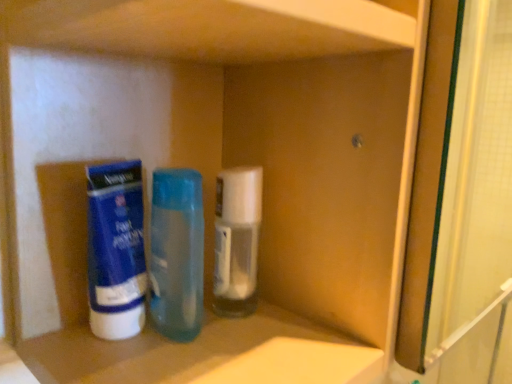
Question: Is point (169, 289) positioned closer to the camera than point (142, 246)?

Choices:
 (A) closer
 (B) farther

Answer: (B)

Question: Is translucent plastic bottle at center, the 2th bottle viewed from the right, in front of or behind blue matte tube at left in the image?

Choices:
 (A) front
 (B) behind

Answer: (B)

Question: Considering the real-world distances, which object is closest to the translucent plastic bottle at center, the 2th bottle viewed from the right?

Choices:
 (A) white plastic container at center, acting as the first bottle starting from the right
 (B) blue matte tube at left

Answer: (A)

Question: Based on their relative distances, which object is farther from the translucent plastic bottle at center, the 2th bottle viewed from the right?

Choices:
 (A) blue matte tube at left
 (B) white plastic container at center, acting as the first bottle starting from the right

Answer: (A)